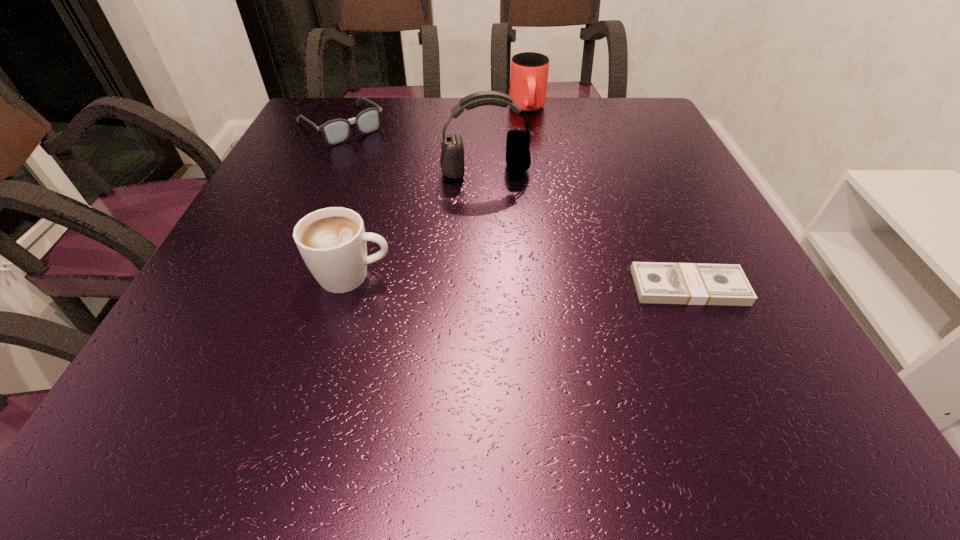
Where is `free space on the desktop that is between the cappuccino and the shortest object and is positioned on the handle side of the cup`? This screenshot has height=540, width=960. free space on the desktop that is between the cappuccino and the shortest object and is positioned on the handle side of the cup is located at coordinates (557, 283).

The width and height of the screenshot is (960, 540). Find the location of `vacant spot on the desktop that is between the cappuccino and the dollar and is positioned on the headband of the third farthest object`. vacant spot on the desktop that is between the cappuccino and the dollar and is positioned on the headband of the third farthest object is located at coordinates coord(516,282).

Image resolution: width=960 pixels, height=540 pixels. Find the location of `vacant spot on the desktop that is between the cappuccino and the rightmost object and is positioned on the face of the spectacles`. vacant spot on the desktop that is between the cappuccino and the rightmost object and is positioned on the face of the spectacles is located at coordinates (514, 281).